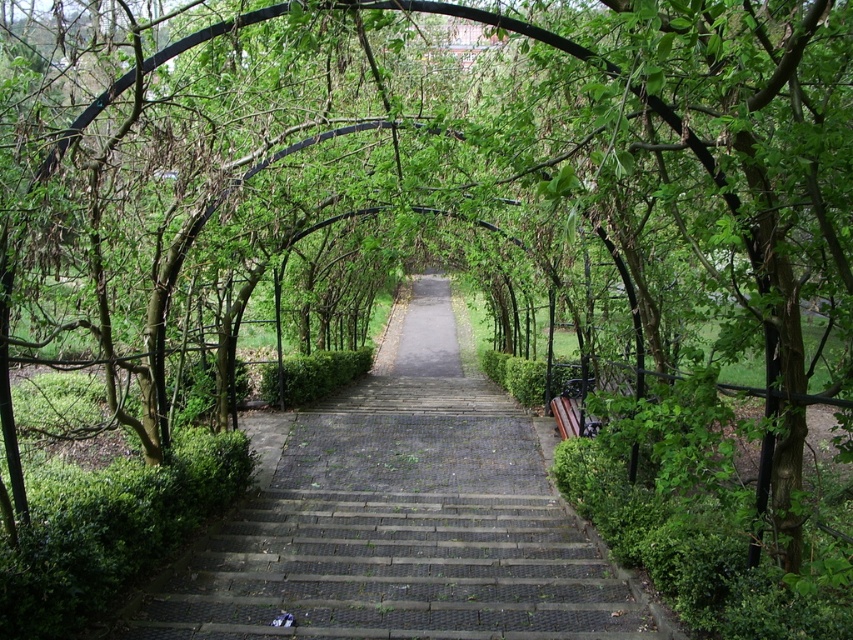
Question: Among these objects, which one is nearest to the camera?

Choices:
 (A) dark gray cobblestone stairs at center
 (B) wooden bench at right

Answer: (A)

Question: Does dark gray cobblestone stairs at center appear on the right side of wooden bench at right?

Choices:
 (A) yes
 (B) no

Answer: (B)

Question: Does dark gray cobblestone stairs at center have a lesser width compared to wooden bench at right?

Choices:
 (A) no
 (B) yes

Answer: (A)

Question: Considering the relative positions of dark gray cobblestone stairs at center and wooden bench at right in the image provided, where is dark gray cobblestone stairs at center located with respect to wooden bench at right?

Choices:
 (A) right
 (B) left

Answer: (B)